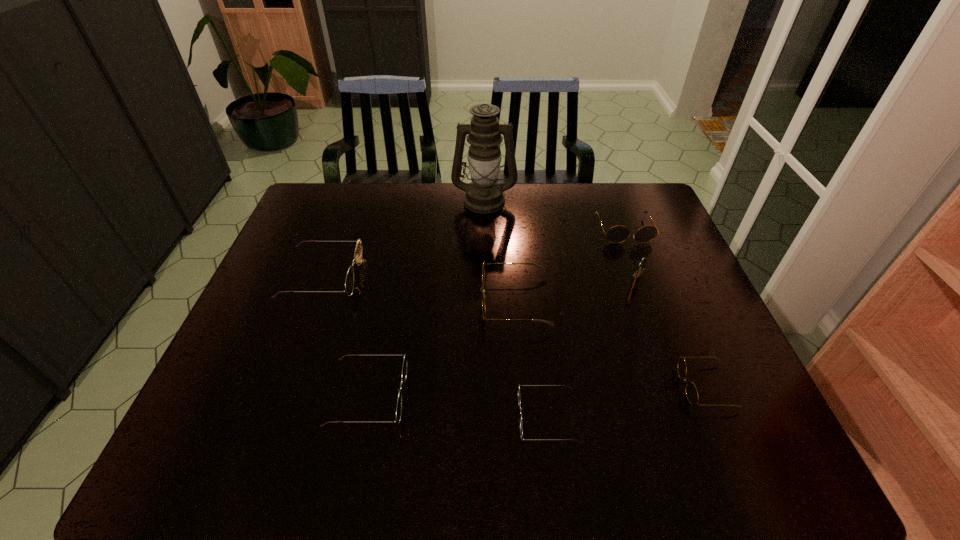
The image size is (960, 540). I want to click on vacant space located 0.230m on the lenses of the second biggest gray sunglasses, so click(651, 299).

Locate an element on the screen. vacant space situated on the front-facing side of the fifth sunglasses from right to left is located at coordinates (508, 395).

Where is `vacant space positioned on the lenses of the smallest gray sunglasses`? vacant space positioned on the lenses of the smallest gray sunglasses is located at coordinates (601, 387).

Where is `vacant space situated on the lenses of the smallest gray sunglasses`? vacant space situated on the lenses of the smallest gray sunglasses is located at coordinates (557, 387).

I want to click on free space located on the lenses of the smallest gray sunglasses, so click(x=659, y=387).

Locate an element on the screen. Image resolution: width=960 pixels, height=540 pixels. vacant point located 0.330m on the front-facing side of the rightmost green sunglasses is located at coordinates (364, 418).

At what (x,y) coordinates should I click in order to perform the action: click on free space located on the front-facing side of the rightmost green sunglasses. Please return your answer as a coordinate pair (x, y). This screenshot has height=540, width=960. Looking at the image, I should click on (383, 418).

I want to click on free space located on the front-facing side of the rightmost green sunglasses, so click(x=397, y=418).

Where is `oil lamp that is at the far edge`? The height and width of the screenshot is (540, 960). oil lamp that is at the far edge is located at coordinates (483, 195).

Locate an element on the screen. This screenshot has height=540, width=960. sunglasses located at the far edge is located at coordinates (617, 234).